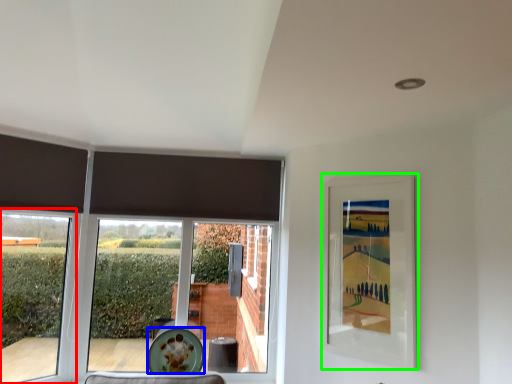
Question: Based on their relative distances, which object is farther from window (highlighted by a red box)? Choose from plate (highlighted by a blue box) and picture frame (highlighted by a green box).

Choices:
 (A) plate
 (B) picture frame

Answer: (B)